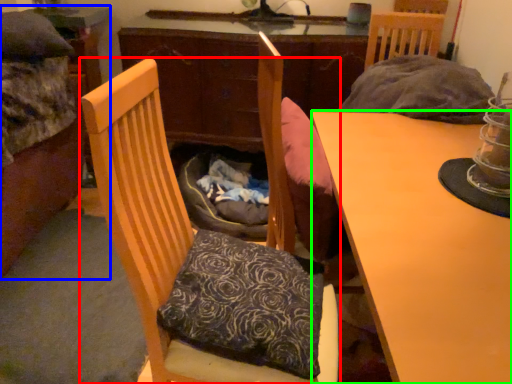
Question: Which is nearer to the chair (highlighted by a red box)? bed (highlighted by a blue box) or desk (highlighted by a green box).

Choices:
 (A) bed
 (B) desk

Answer: (B)